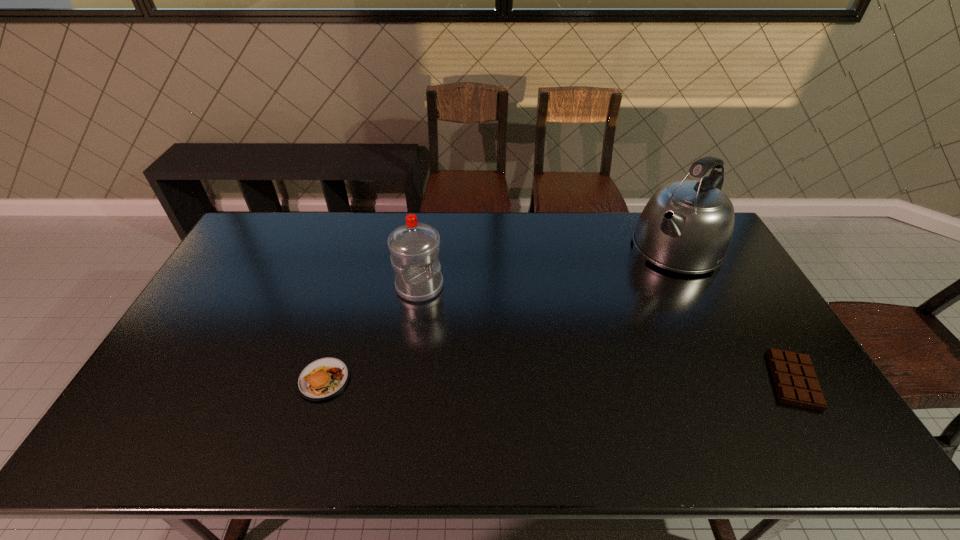
Identify the location of free location that satisfies the following two spatial constraints: 1. on the back side of the tallest object; 2. on the left side of the leftmost object. Image resolution: width=960 pixels, height=540 pixels. (364, 248).

At what (x,y) coordinates should I click in order to perform the action: click on vacant point that satisfies the following two spatial constraints: 1. on the front side of the candy bar; 2. on the left side of the kettle. Please return your answer as a coordinate pair (x, y). Looking at the image, I should click on pos(745,380).